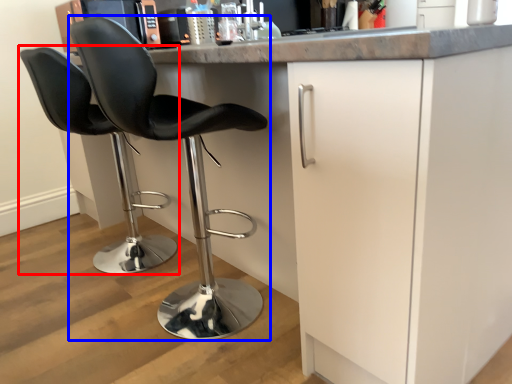
Question: Which of the following is the farthest to the observer, chair (highlighted by a red box) or chair (highlighted by a blue box)?

Choices:
 (A) chair
 (B) chair

Answer: (A)